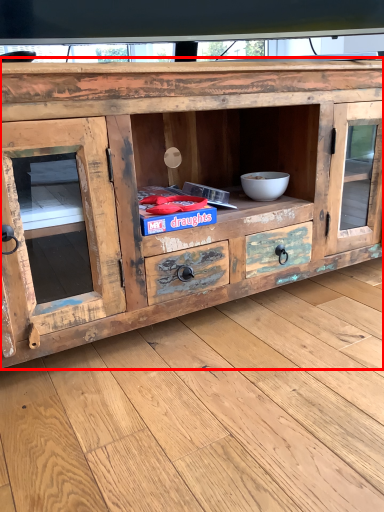
Question: Considering the relative positions of chest of drawers (annotated by the red box) and bowl in the image provided, where is chest of drawers (annotated by the red box) located with respect to the staircase?

Choices:
 (A) left
 (B) right

Answer: (A)